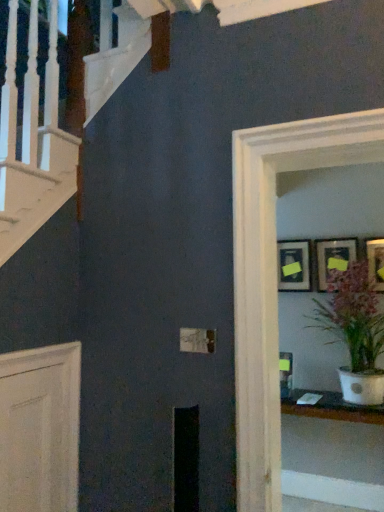
Question: From a real-world perspective, is white glossy pot at center-right under matte black picture frame at upper right, the 1th picture frame viewed from the right?

Choices:
 (A) yes
 (B) no

Answer: (A)

Question: Is white glossy pot at center-right taller than matte black picture frame at upper right, the 3th picture frame when ordered from left to right?

Choices:
 (A) no
 (B) yes

Answer: (B)

Question: Does white glossy pot at center-right have a greater width compared to matte black picture frame at upper right, the 3th picture frame when ordered from left to right?

Choices:
 (A) yes
 (B) no

Answer: (A)

Question: Is white glossy pot at center-right closer to camera compared to matte black picture frame at upper right, the 3th picture frame when ordered from left to right?

Choices:
 (A) yes
 (B) no

Answer: (A)

Question: Is white glossy pot at center-right far away from matte black picture frame at upper right, the 3th picture frame when ordered from left to right?

Choices:
 (A) yes
 (B) no

Answer: (B)

Question: Looking at their shapes, would you say matte black picture frame at upper right, the 3th picture frame when ordered from left to right, is wider or thinner than matte black picture frame at upper right, which appears as the 2th picture frame when viewed from the right?

Choices:
 (A) thin
 (B) wide

Answer: (B)

Question: Considering the positions of matte black picture frame at upper right, the 1th picture frame viewed from the right, and matte black picture frame at upper right, the second picture frame viewed from the left, in the image, is matte black picture frame at upper right, the 1th picture frame viewed from the right, taller or shorter than matte black picture frame at upper right, the second picture frame viewed from the left,?

Choices:
 (A) tall
 (B) short

Answer: (A)

Question: Considering the positions of point (367, 245) and point (324, 287), is point (367, 245) closer or farther from the camera than point (324, 287)?

Choices:
 (A) farther
 (B) closer

Answer: (B)

Question: From a real-world perspective, relative to matte black picture frame at upper right, which appears as the 2th picture frame when viewed from the right, is matte black picture frame at upper right, the 1th picture frame viewed from the right, vertically above or below?

Choices:
 (A) above
 (B) below

Answer: (A)

Question: From their relative heights in the image, would you say matte black picture frame at upper right, which appears as the 2th picture frame when viewed from the right, is taller or shorter than matte black picture frame at upper right, which is the first picture frame from left to right?

Choices:
 (A) tall
 (B) short

Answer: (A)

Question: Is matte black picture frame at upper right, the second picture frame viewed from the left, situated inside matte black picture frame at upper right, acting as the 3th picture frame starting from the right, or outside?

Choices:
 (A) outside
 (B) inside

Answer: (A)

Question: From the image's perspective, is matte black picture frame at upper right, which appears as the 2th picture frame when viewed from the right, located above or below matte black picture frame at upper right, acting as the 3th picture frame starting from the right?

Choices:
 (A) below
 (B) above

Answer: (B)

Question: In the image, is matte black picture frame at upper right, the second picture frame viewed from the left, positioned in front of or behind matte black picture frame at upper right, which is the first picture frame from left to right?

Choices:
 (A) behind
 (B) front

Answer: (B)

Question: Considering their positions, is white glossy pot at center-right located in front of or behind matte black picture frame at upper right, acting as the 3th picture frame starting from the right?

Choices:
 (A) behind
 (B) front

Answer: (B)

Question: Is white glossy pot at center-right taller or shorter than matte black picture frame at upper right, which is the first picture frame from left to right?

Choices:
 (A) tall
 (B) short

Answer: (A)